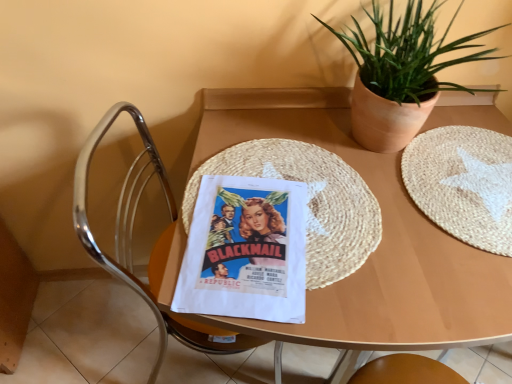
The width and height of the screenshot is (512, 384). Find the location of `free point above woven straw mat at center (from a real-world perspective)`. free point above woven straw mat at center (from a real-world perspective) is located at coordinates (281, 204).